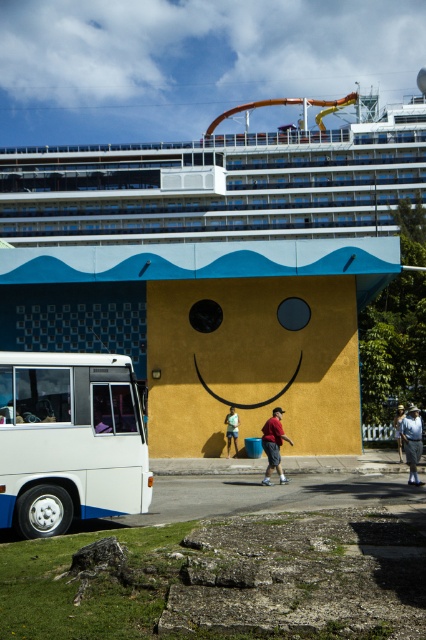
Find the location of `light blue fabric shirt at center`. light blue fabric shirt at center is located at coordinates (411, 442).

Between light blue fabric shirt at center and yellow matte face at center, which one appears on the left side from the viewer's perspective?

From the viewer's perspective, yellow matte face at center appears more on the left side.

This screenshot has height=640, width=426. What do you see at coordinates (411, 442) in the screenshot? I see `light blue fabric shirt at center` at bounding box center [411, 442].

In order to click on light blue fabric shirt at center in this screenshot , I will do `click(411, 442)`.

Does point (299, 104) come in front of point (78, 449)?

No, it is not.

Who is positioned more to the right, white glossy cruise ship at upper center or white matte tour bus at lower left?

white glossy cruise ship at upper center is more to the right.

What do you see at coordinates (219, 182) in the screenshot?
I see `white glossy cruise ship at upper center` at bounding box center [219, 182].

This screenshot has width=426, height=640. Identify the location of white glossy cruise ship at upper center. pos(219,182).

Looking at this image, does white matte tour bus at lower left have a smaller size compared to light brown wooden hat at center?

Correct, white matte tour bus at lower left occupies less space than light brown wooden hat at center.

Can you confirm if white matte tour bus at lower left is wider than light brown wooden hat at center?

No, white matte tour bus at lower left is not wider than light brown wooden hat at center.

Does point (54, 506) come in front of point (397, 426)?

Yes, point (54, 506) is in front of point (397, 426).

Find the location of a particular element. white matte tour bus at lower left is located at coordinates (69, 440).